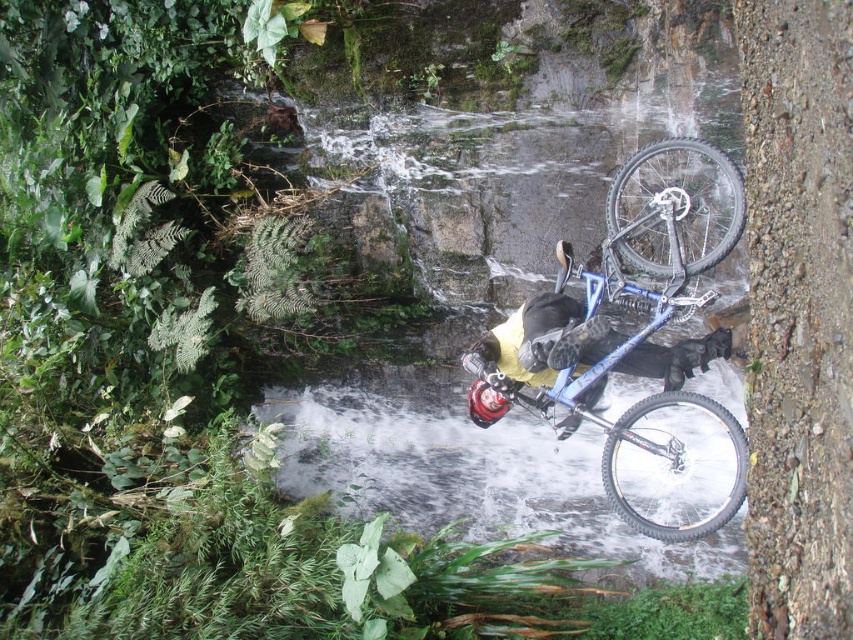
You are a photographer trying to capture the cyclist and their bike in the frame. Given that the blue metallic mountain bike at center and the clear water at center are both in the scene, which one takes up more space in the photo?

The clear water at center takes up more space in the photo because the blue metallic mountain bike at center occupies less space than clear water at center according to the description.